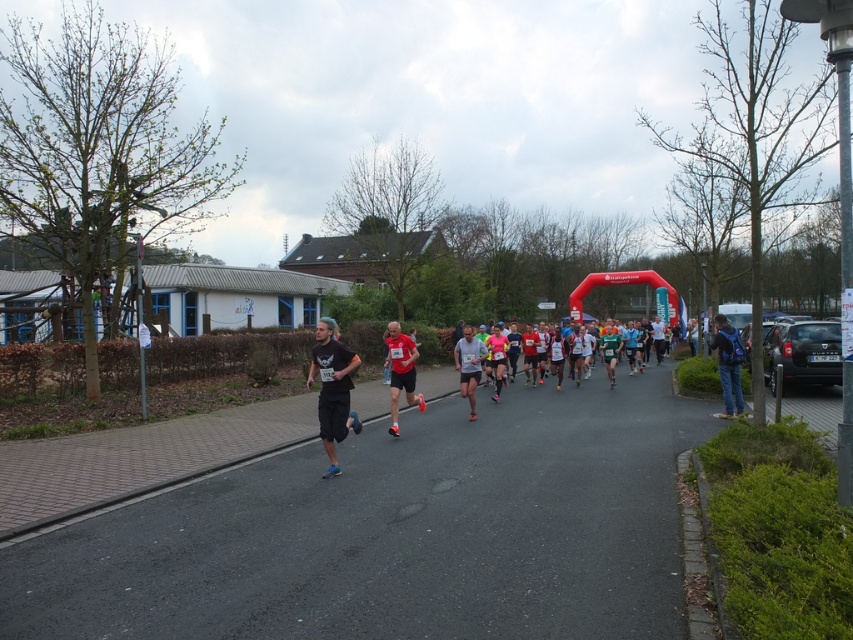
Question: Which point is farther to the camera?

Choices:
 (A) red running shoe at center
 (B) gray fabric shirt at center

Answer: (B)

Question: Is black matte shorts at center to the right of gray fabric shirt at center from the viewer's perspective?

Choices:
 (A) no
 (B) yes

Answer: (A)

Question: From the image, what is the correct spatial relationship of red running shoe at center in relation to gray fabric shirt at center?

Choices:
 (A) left
 (B) right

Answer: (A)

Question: Which is farther from the red running shoe at center?

Choices:
 (A) black matte shorts at center
 (B) gray fabric shirt at center

Answer: (A)

Question: Can you confirm if red running shoe at center is positioned above gray fabric shirt at center?

Choices:
 (A) yes
 (B) no

Answer: (A)

Question: Which is farther from the red running shoe at center?

Choices:
 (A) black matte shorts at center
 (B) gray fabric shirt at center

Answer: (A)